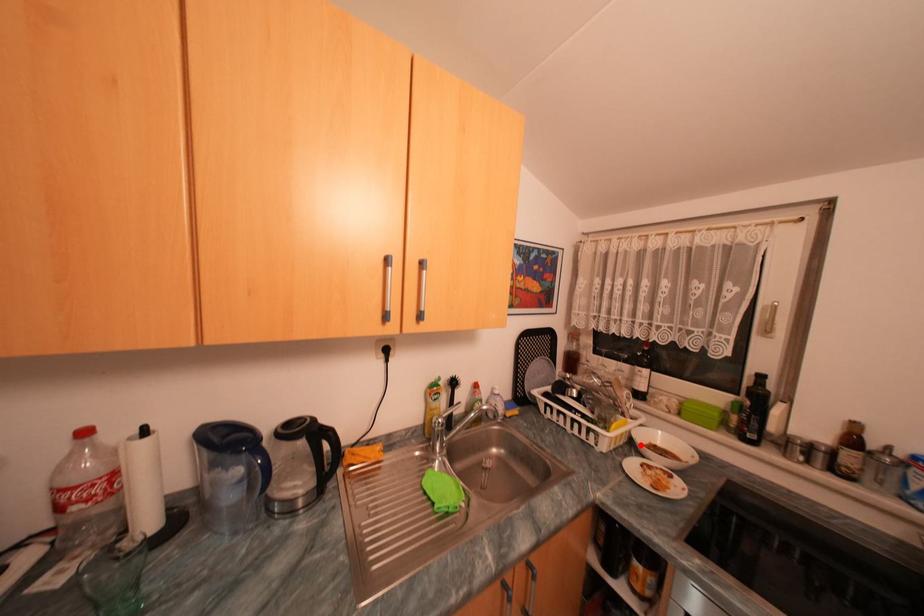
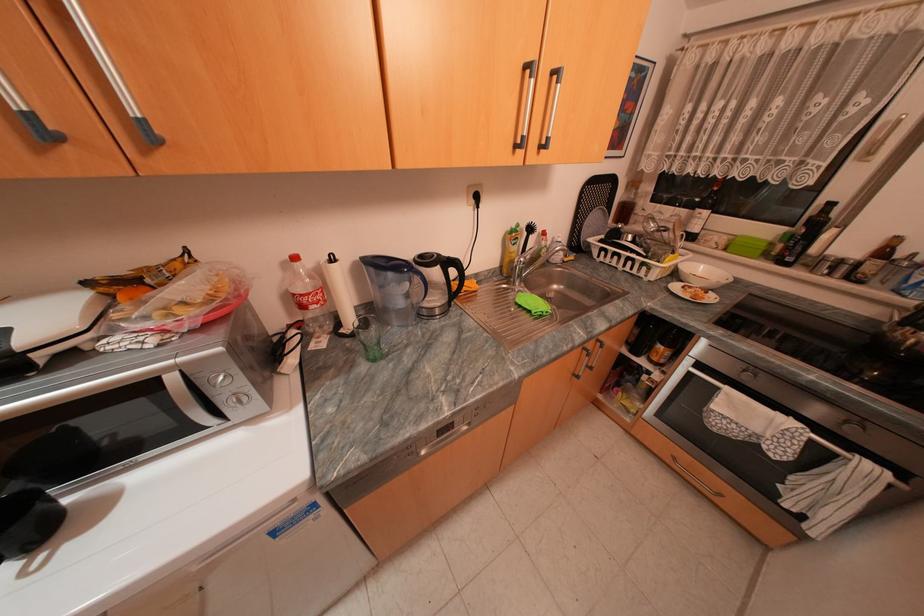
Find the pixel in the second image that matches the highlighted location in the first image.

(685, 275)